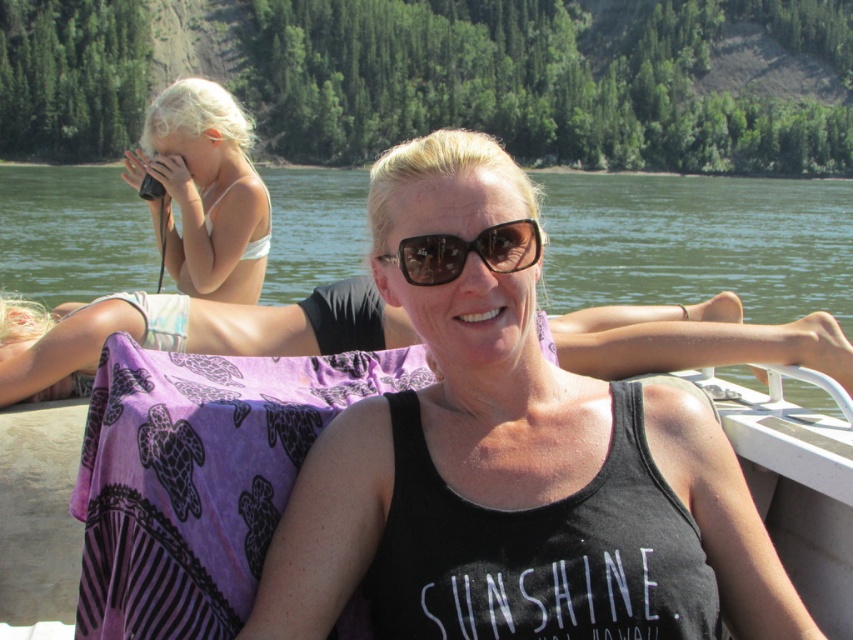
The image size is (853, 640). Describe the element at coordinates (512, 467) in the screenshot. I see `black tank top at center` at that location.

Is black tank top at center below clear water at center?

Yes.

Between point (457, 376) and point (836, 356), which one is positioned in front?

Positioned in front is point (457, 376).

I want to click on black tank top at center, so click(512, 467).

Does black tank top at center have a lesser width compared to brown matte sunglasses at center?

In fact, black tank top at center might be wider than brown matte sunglasses at center.

Which is behind, point (328, 506) or point (422, 278)?

The point (422, 278) is behind.

At what (x,y) coordinates should I click in order to perform the action: click on black tank top at center. Please return your answer as a coordinate pair (x, y). Looking at the image, I should click on (512, 467).

Where is `clear water at center`? Image resolution: width=853 pixels, height=640 pixels. clear water at center is located at coordinates point(695,241).

Which is below, clear water at center or white bikini at upper left?

white bikini at upper left is below.

Is point (784, 288) positioned before point (193, 198)?

No, (784, 288) is further to viewer.

The image size is (853, 640). I want to click on clear water at center, so click(x=695, y=241).